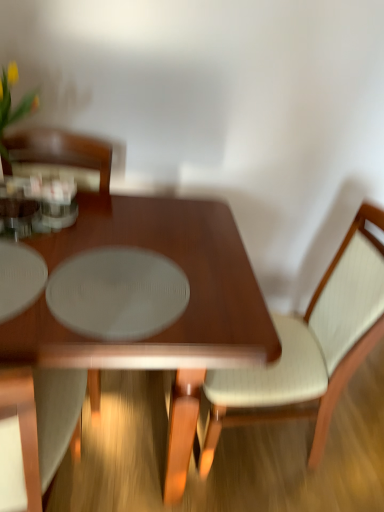
Question: From their relative heights in the image, would you say light beige fabric chair at center, placed as the 2th chair when sorted from left to right, is taller or shorter than shiny brown table at center?

Choices:
 (A) tall
 (B) short

Answer: (A)

Question: Is point (218, 413) positioned closer to the camera than point (38, 340)?

Choices:
 (A) closer
 (B) farther

Answer: (B)

Question: Estimate the real-world distances between objects in this image. Which object is farther from the white fabric chair at left, acting as the 2th chair starting from the right?

Choices:
 (A) shiny brown table at center
 (B) light beige fabric chair at center, placed as the 2th chair when sorted from left to right

Answer: (B)

Question: Estimate the real-world distances between objects in this image. Which object is closer to the shiny brown table at center?

Choices:
 (A) white fabric chair at left, acting as the 2th chair starting from the right
 (B) light beige fabric chair at center, positioned as the first chair in right-to-left order

Answer: (A)